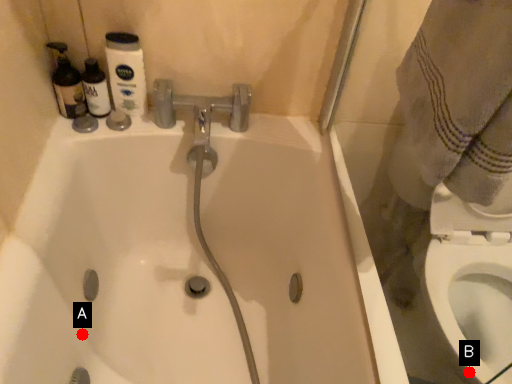
Question: Two points are circled on the image, labeled by A and B beside each circle. Which of the following is the closest to the observer?

Choices:
 (A) A is closer
 (B) B is closer

Answer: (B)